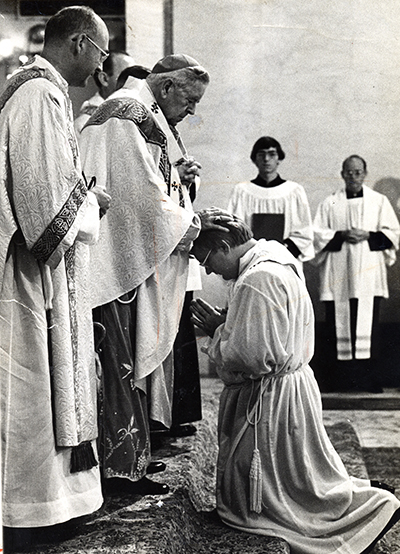
I want to click on sash, so click(x=254, y=458).